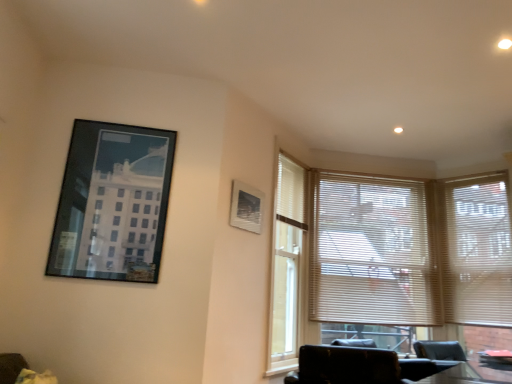
Describe the element at coordinates (113, 203) in the screenshot. I see `matte black picture frame at upper left, the first picture frame from the left` at that location.

What is the approximate width of white blinds at right, the 1th window blind positioned from the right?

white blinds at right, the 1th window blind positioned from the right, is 3.61 inches in width.

Describe the element at coordinates (477, 251) in the screenshot. I see `white blinds at right, placed as the second window blind when sorted from left to right` at that location.

Identify the location of black leather chair at lower right. pos(360,366).

The height and width of the screenshot is (384, 512). Find the location of `matte white picture frame at upper center, which appears as the second picture frame when viewed from the left`. matte white picture frame at upper center, which appears as the second picture frame when viewed from the left is located at coordinates (246, 207).

Find the location of a particular element. beige/wooden blinds at center, the 2th window blind positioned from the right is located at coordinates (373, 251).

Which is more to the right, beige/wooden blinds at center, which appears as the 1th window blind when viewed from the left, or white blinds at right, placed as the second window blind when sorted from left to right?

white blinds at right, placed as the second window blind when sorted from left to right, is more to the right.

How different are the orientations of beige/wooden blinds at center, which appears as the 1th window blind when viewed from the left, and white blinds at right, the 1th window blind positioned from the right, in degrees?

The angular difference between beige/wooden blinds at center, which appears as the 1th window blind when viewed from the left, and white blinds at right, the 1th window blind positioned from the right, is 50.3 degrees.

Is white blinds at right, placed as the second window blind when sorted from left to right, at the back of beige/wooden blinds at center, which appears as the 1th window blind when viewed from the left?

beige/wooden blinds at center, which appears as the 1th window blind when viewed from the left, does not have its back to white blinds at right, placed as the second window blind when sorted from left to right.

From the image's perspective, between beige/wooden blinds at center, the 2th window blind positioned from the right, and white blinds at right, placed as the second window blind when sorted from left to right, which one is located above?

From the image's view, white blinds at right, placed as the second window blind when sorted from left to right, is above.

In the scene shown: Does beige/wooden blinds at center, the 2th window blind positioned from the right, contain black leather chair at lower right?

No, black leather chair at lower right is not surrounded by beige/wooden blinds at center, the 2th window blind positioned from the right.

Does beige/wooden blinds at center, the 2th window blind positioned from the right, have a greater height compared to black leather chair at lower right?

Correct, beige/wooden blinds at center, the 2th window blind positioned from the right, is much taller as black leather chair at lower right.

Is beige/wooden blinds at center, which appears as the 1th window blind when viewed from the left, closer to the viewer compared to black leather chair at lower right?

No, it is behind black leather chair at lower right.

Where is `chair below the beige/wooden blinds at center, which appears as the 1th window blind when viewed from the left (from the image's perspective)`? The width and height of the screenshot is (512, 384). chair below the beige/wooden blinds at center, which appears as the 1th window blind when viewed from the left (from the image's perspective) is located at coordinates 360,366.

Between black leather chair at lower right and white blinds at right, the 1th window blind positioned from the right, which one appears on the right side from the viewer's perspective?

white blinds at right, the 1th window blind positioned from the right.

Considering the sizes of black leather chair at lower right and white blinds at right, the 1th window blind positioned from the right, in the image, is black leather chair at lower right wider or thinner than white blinds at right, the 1th window blind positioned from the right,?

Considering their sizes, black leather chair at lower right looks broader than white blinds at right, the 1th window blind positioned from the right.

Is black leather chair at lower right oriented towards white blinds at right, placed as the second window blind when sorted from left to right?

No, black leather chair at lower right is not facing towards white blinds at right, placed as the second window blind when sorted from left to right.

From the image's perspective, which object appears higher, black leather chair at lower right or white blinds at right, the 1th window blind positioned from the right?

white blinds at right, the 1th window blind positioned from the right, from the image's perspective.

Is point (356, 321) in front of point (258, 195)?

No, (356, 321) is behind (258, 195).

From the image's perspective, starting from the beige/wooden blinds at center, the 2th window blind positioned from the right, which picture frame is the 1st one above? Please provide its 2D coordinates.

[(246, 207)]

From the picture: Does beige/wooden blinds at center, which appears as the 1th window blind when viewed from the left, have a lesser width compared to matte white picture frame at upper center, positioned as the first picture frame in back-to-front order?

No.

From a real-world perspective, is matte black picture frame at upper left, which appears as the first picture frame when viewed from the front, beneath matte white picture frame at upper center, positioned as the first picture frame in back-to-front order?

Yes, from a real-world perspective, matte black picture frame at upper left, which appears as the first picture frame when viewed from the front, is below matte white picture frame at upper center, positioned as the first picture frame in back-to-front order.

Is matte black picture frame at upper left, the first picture frame from the left, positioned beyond the bounds of matte white picture frame at upper center, the first picture frame viewed from the right?

That's correct, matte black picture frame at upper left, the first picture frame from the left, is outside of matte white picture frame at upper center, the first picture frame viewed from the right.

Consider the image. Considering the relative sizes of matte black picture frame at upper left, which appears as the second picture frame when viewed from the right, and matte white picture frame at upper center, the first picture frame viewed from the right, in the image provided, is matte black picture frame at upper left, which appears as the second picture frame when viewed from the right, thinner than matte white picture frame at upper center, the first picture frame viewed from the right,?

Incorrect, the width of matte black picture frame at upper left, which appears as the second picture frame when viewed from the right, is not less than that of matte white picture frame at upper center, the first picture frame viewed from the right.

From the picture: Who is bigger, matte black picture frame at upper left, which appears as the second picture frame when viewed from the right, or matte white picture frame at upper center, which appears as the second picture frame when viewed from the left?

matte black picture frame at upper left, which appears as the second picture frame when viewed from the right.

Can you tell me how much white blinds at right, the 1th window blind positioned from the right, and matte white picture frame at upper center, positioned as the first picture frame in back-to-front order, differ in facing direction?

101 degrees separate the facing orientations of white blinds at right, the 1th window blind positioned from the right, and matte white picture frame at upper center, positioned as the first picture frame in back-to-front order.

Considering the relative sizes of white blinds at right, placed as the second window blind when sorted from left to right, and matte white picture frame at upper center, which appears as the second picture frame when viewed from the left, in the image provided, is white blinds at right, placed as the second window blind when sorted from left to right, wider than matte white picture frame at upper center, which appears as the second picture frame when viewed from the left,?

Indeed, white blinds at right, placed as the second window blind when sorted from left to right, has a greater width compared to matte white picture frame at upper center, which appears as the second picture frame when viewed from the left.

Could you tell me if white blinds at right, the 1th window blind positioned from the right, is facing matte white picture frame at upper center, which appears as the second picture frame when viewed from the left?

No, white blinds at right, the 1th window blind positioned from the right, is not turned towards matte white picture frame at upper center, which appears as the second picture frame when viewed from the left.

Can you confirm if white blinds at right, placed as the second window blind when sorted from left to right, is bigger than matte white picture frame at upper center, the first picture frame viewed from the right?

Correct, white blinds at right, placed as the second window blind when sorted from left to right, is larger in size than matte white picture frame at upper center, the first picture frame viewed from the right.

Between matte white picture frame at upper center, the first picture frame viewed from the right, and matte black picture frame at upper left, which ranks as the 2th picture frame in back-to-front order, which one has less height?

matte white picture frame at upper center, the first picture frame viewed from the right, is shorter.

From the picture: Does matte white picture frame at upper center, the first picture frame viewed from the right, have a larger size compared to matte black picture frame at upper left, which appears as the first picture frame when viewed from the front?

Incorrect, matte white picture frame at upper center, the first picture frame viewed from the right, is not larger than matte black picture frame at upper left, which appears as the first picture frame when viewed from the front.

Considering the relative sizes of matte white picture frame at upper center, positioned as the first picture frame in back-to-front order, and matte black picture frame at upper left, which appears as the first picture frame when viewed from the front, in the image provided, is matte white picture frame at upper center, positioned as the first picture frame in back-to-front order, wider than matte black picture frame at upper left, which appears as the first picture frame when viewed from the front,?

In fact, matte white picture frame at upper center, positioned as the first picture frame in back-to-front order, might be narrower than matte black picture frame at upper left, which appears as the first picture frame when viewed from the front.

You are a GUI agent. You are given a task and a screenshot of the screen. Output one action in this format:
    pyautogui.click(x=<x>, y=<y>)
    Task: Click on the picture frame below the matte black picture frame at upper left, which ranks as the 2th picture frame in back-to-front order (from the image's perspective)
    This screenshot has width=512, height=384.
    Given the screenshot: What is the action you would take?
    pyautogui.click(x=246, y=207)

I want to click on window blind that appears on the right of beige/wooden blinds at center, which appears as the 1th window blind when viewed from the left, so click(477, 251).

The height and width of the screenshot is (384, 512). Find the location of `the 1st window blind positioned above the black leather chair at lower right (from a real-world perspective)`. the 1st window blind positioned above the black leather chair at lower right (from a real-world perspective) is located at coordinates (373, 251).

Which object lies further to the anchor point matte black picture frame at upper left, which ranks as the 2th picture frame in back-to-front order, black leather chair at lower right or beige/wooden blinds at center, the 2th window blind positioned from the right?

beige/wooden blinds at center, the 2th window blind positioned from the right, is further to matte black picture frame at upper left, which ranks as the 2th picture frame in back-to-front order.

Which object lies further to the anchor point white blinds at right, placed as the second window blind when sorted from left to right, black leather chair at lower right or matte black picture frame at upper left, which appears as the first picture frame when viewed from the front?

matte black picture frame at upper left, which appears as the first picture frame when viewed from the front.

In the scene shown: From the image, which object appears to be nearer to matte white picture frame at upper center, the first picture frame viewed from the right, matte black picture frame at upper left, which ranks as the 2th picture frame in back-to-front order, or black leather chair at lower right?

The object closer to matte white picture frame at upper center, the first picture frame viewed from the right, is matte black picture frame at upper left, which ranks as the 2th picture frame in back-to-front order.

Considering their positions, is black leather chair at lower right positioned closer to matte black picture frame at upper left, which ranks as the 2th picture frame in back-to-front order, than white blinds at right, the 1th window blind positioned from the right?

black leather chair at lower right is closer to matte black picture frame at upper left, which ranks as the 2th picture frame in back-to-front order.

Based on their spatial positions, is beige/wooden blinds at center, which appears as the 1th window blind when viewed from the left, or white blinds at right, placed as the second window blind when sorted from left to right, further from matte white picture frame at upper center, positioned as the first picture frame in back-to-front order?

white blinds at right, placed as the second window blind when sorted from left to right, is further to matte white picture frame at upper center, positioned as the first picture frame in back-to-front order.

When comparing their distances from matte black picture frame at upper left, which ranks as the 2th picture frame in back-to-front order, does beige/wooden blinds at center, which appears as the 1th window blind when viewed from the left, or matte white picture frame at upper center, positioned as the second picture frame in front-to-back order, seem closer?

matte white picture frame at upper center, positioned as the second picture frame in front-to-back order.

From the image, which object appears to be farther from white blinds at right, placed as the second window blind when sorted from left to right, matte black picture frame at upper left, which appears as the first picture frame when viewed from the front, or black leather chair at lower right?

matte black picture frame at upper left, which appears as the first picture frame when viewed from the front, lies further to white blinds at right, placed as the second window blind when sorted from left to right, than the other object.

Considering their positions, is matte white picture frame at upper center, which appears as the second picture frame when viewed from the left, positioned further to beige/wooden blinds at center, the 2th window blind positioned from the right, than black leather chair at lower right?

black leather chair at lower right is further to beige/wooden blinds at center, the 2th window blind positioned from the right.

Where is `picture frame between matte black picture frame at upper left, which appears as the second picture frame when viewed from the right, and black leather chair at lower right, in the horizontal direction`? The width and height of the screenshot is (512, 384). picture frame between matte black picture frame at upper left, which appears as the second picture frame when viewed from the right, and black leather chair at lower right, in the horizontal direction is located at coordinates (246, 207).

In order to click on chair located between matte white picture frame at upper center, positioned as the second picture frame in front-to-back order, and white blinds at right, the 1th window blind positioned from the right, in the left-right direction in this screenshot , I will do `click(360, 366)`.

What are the coordinates of `picture frame between matte black picture frame at upper left, the first picture frame from the left, and beige/wooden blinds at center, which appears as the 1th window blind when viewed from the left, from left to right` in the screenshot? It's located at (246, 207).

Where is `chair situated between matte black picture frame at upper left, the first picture frame from the left, and beige/wooden blinds at center, which appears as the 1th window blind when viewed from the left, from left to right`? This screenshot has height=384, width=512. chair situated between matte black picture frame at upper left, the first picture frame from the left, and beige/wooden blinds at center, which appears as the 1th window blind when viewed from the left, from left to right is located at coordinates (360, 366).